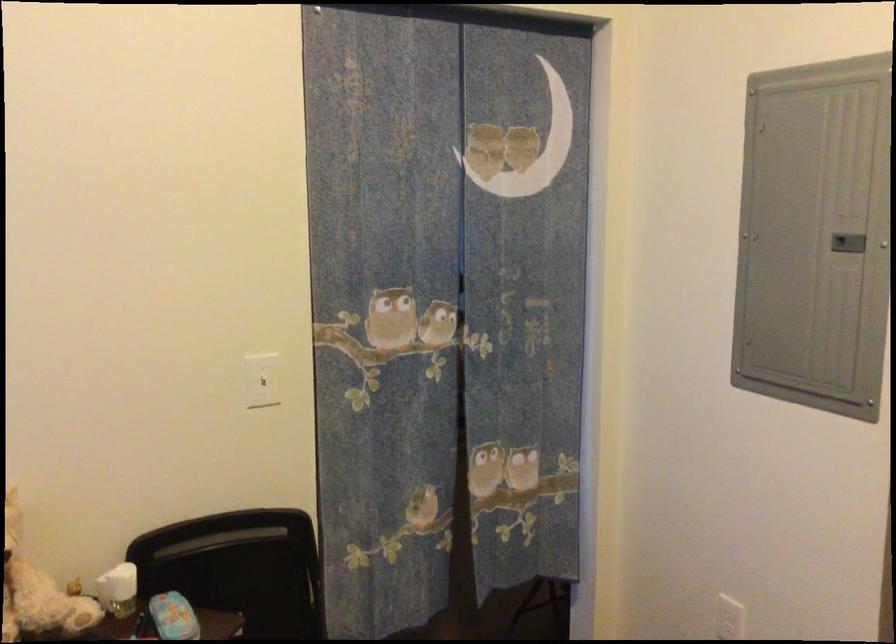
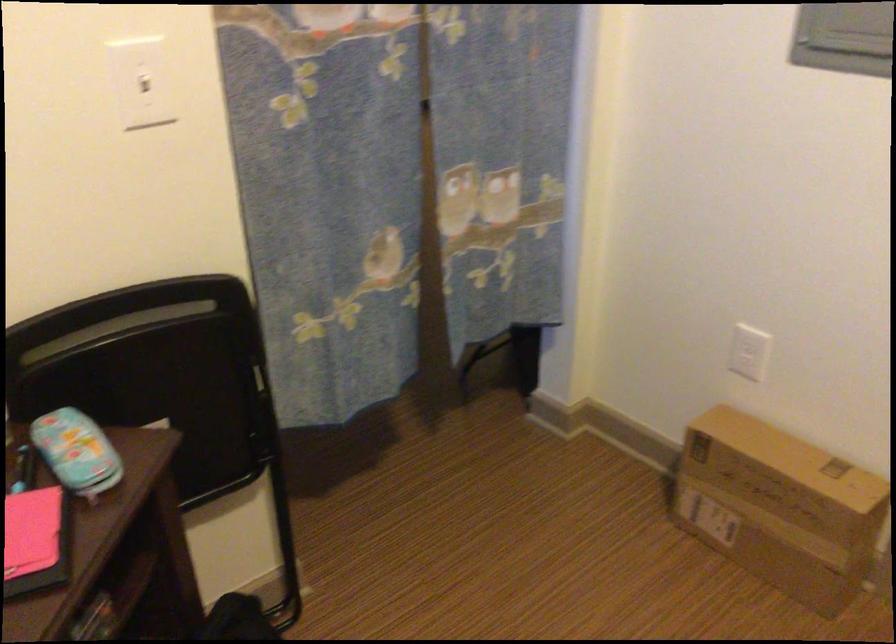
What movement of the cameraman would produce the second image?

The movement direction of the cameraman is left, forward.